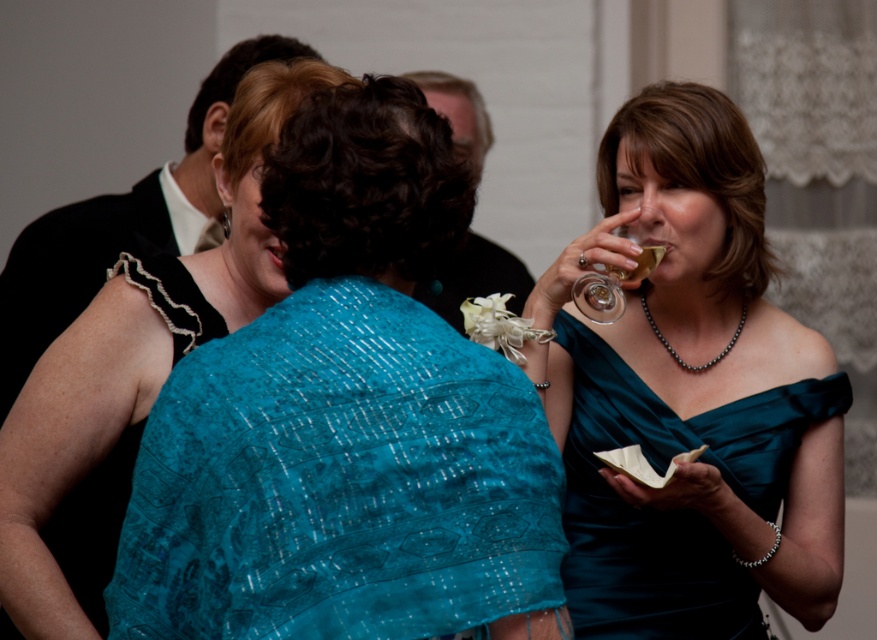
Question: Is teal lace shawl at center above teal satin dress at center?

Choices:
 (A) no
 (B) yes

Answer: (A)

Question: Which object is farther from the camera taking this photo?

Choices:
 (A) translucent glass at upper right
 (B) clear glass wine glass at right
 (C) teal satin dress at center
 (D) teal lace dress at center

Answer: (A)

Question: Which point appears farthest from the camera in this image?

Choices:
 (A) (165, 515)
 (B) (103, 458)
 (C) (601, 314)
 (D) (678, 580)

Answer: (C)

Question: Does teal lace shawl at center have a larger size compared to clear glass wine glass at right?

Choices:
 (A) no
 (B) yes

Answer: (B)

Question: Can you confirm if teal satin dress at center is smaller than teal satin dress at right?

Choices:
 (A) yes
 (B) no

Answer: (B)

Question: Which of the following is the farthest from the observer?

Choices:
 (A) (624, 413)
 (B) (133, 340)

Answer: (A)